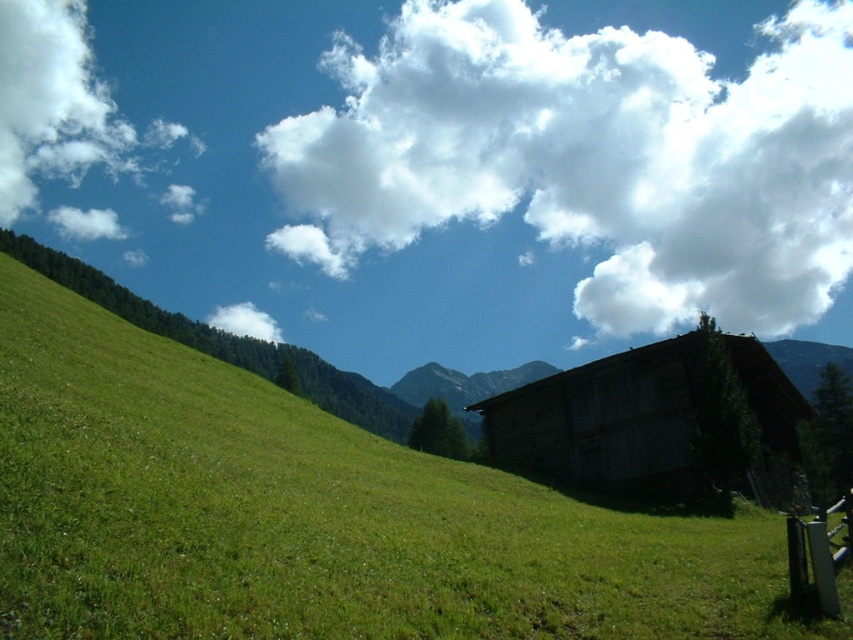
Question: Is green grassy at lower left behind weathered wood barn at lower right?

Choices:
 (A) no
 (B) yes

Answer: (A)

Question: Which point is farther from the camera taking this photo?

Choices:
 (A) (732, 282)
 (B) (91, 531)

Answer: (A)

Question: Which point is closer to the camera?

Choices:
 (A) white fluffy cloud at upper center
 (B) weathered wood barn at lower right
 (C) green grassy at lower left

Answer: (C)

Question: Can you confirm if white fluffy cloud at upper center is smaller than weathered wood barn at lower right?

Choices:
 (A) no
 (B) yes

Answer: (A)

Question: Where is green grassy at lower left located in relation to weathered wood barn at lower right in the image?

Choices:
 (A) below
 (B) above

Answer: (B)

Question: Which point is farther to the camera?

Choices:
 (A) (640, 211)
 (B) (691, 396)
 (C) (54, 605)

Answer: (A)